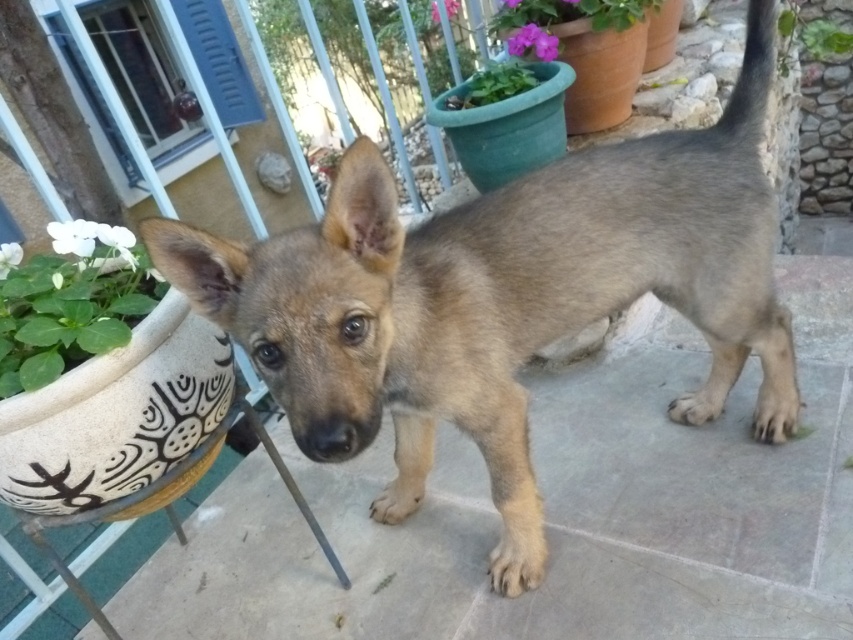
Question: Does fuzzy brown puppy at center have a larger size compared to green leafy plant at lower left?

Choices:
 (A) yes
 (B) no

Answer: (A)

Question: Is green leafy plant at upper right to the left of green matte pot at upper center from the viewer's perspective?

Choices:
 (A) no
 (B) yes

Answer: (A)

Question: Which point is closer to the camera taking this photo?

Choices:
 (A) (729, 236)
 (B) (44, 312)

Answer: (B)

Question: Which of the following is the farthest from the observer?

Choices:
 (A) green matte pot at upper center
 (B) fuzzy brown puppy at center
 (C) green leafy plant at upper right
 (D) green leafy plant at lower left

Answer: (C)

Question: Which of the following is the closest to the observer?

Choices:
 (A) (509, 61)
 (B) (131, 276)

Answer: (B)

Question: Is green leafy plant at upper right thinner than green matte pot at upper center?

Choices:
 (A) no
 (B) yes

Answer: (A)